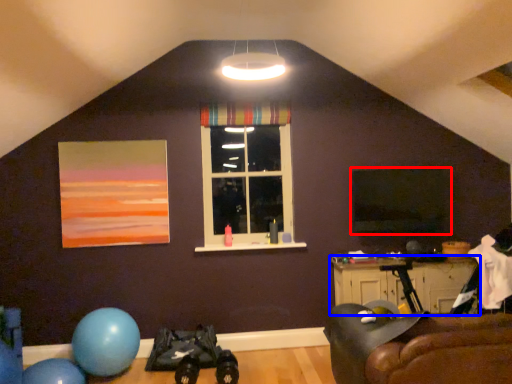
Question: Among these objects, which one is nearest to the camera, window screen (highlighted by a red box) or table (highlighted by a blue box)?

Choices:
 (A) window screen
 (B) table

Answer: (B)